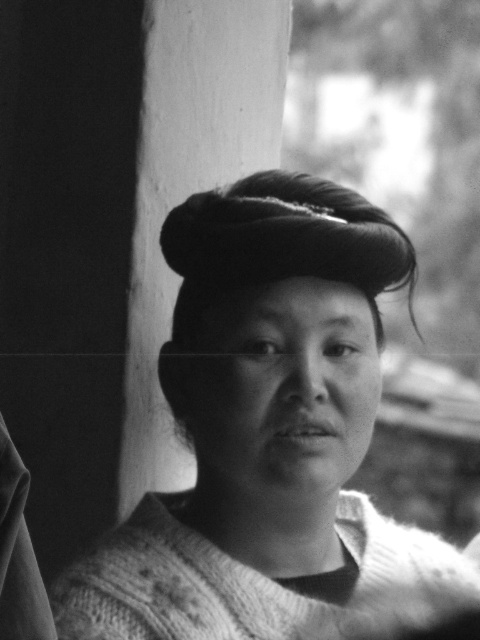
Does knitted sweater at center appear under dark matte hair bun at center?

Yes, knitted sweater at center is below dark matte hair bun at center.

Does knitted sweater at center have a lesser height compared to dark matte hair bun at center?

Incorrect, knitted sweater at center's height does not fall short of dark matte hair bun at center's.

Is point (373, 216) behind point (398, 252)?

That is True.

The width and height of the screenshot is (480, 640). I want to click on knitted sweater at center, so click(x=263, y=426).